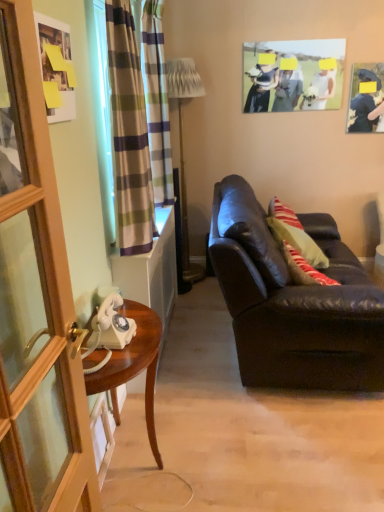
Where is `vacant space in between wooden desk at left and matte black couch at right`? The image size is (384, 512). vacant space in between wooden desk at left and matte black couch at right is located at coordinates (228, 404).